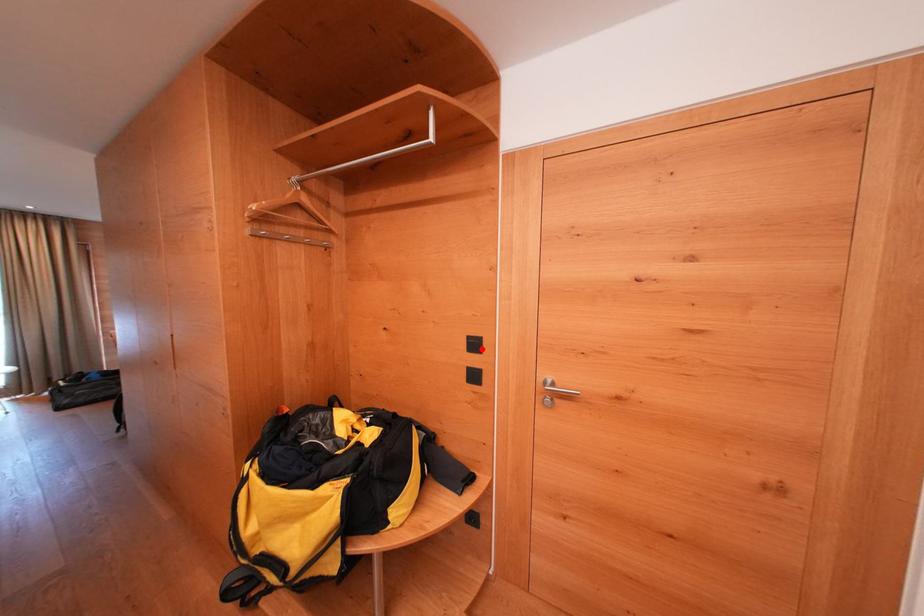
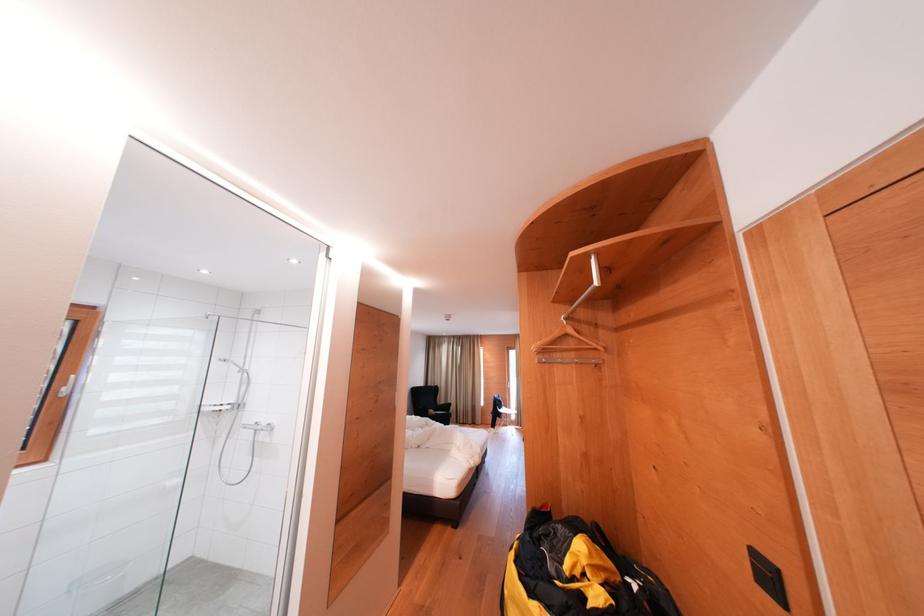
Find the pixel in the second image that matches the highlighted location in the first image.

(776, 582)